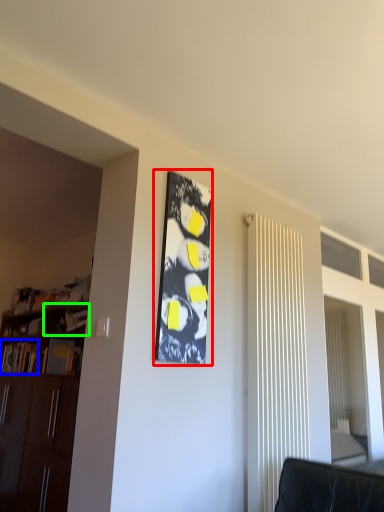
Question: Based on their relative distances, which object is farther from bulletin board (highlighted by a red box)? Choose from book (highlighted by a blue box) and shelf (highlighted by a green box).

Choices:
 (A) book
 (B) shelf

Answer: (A)